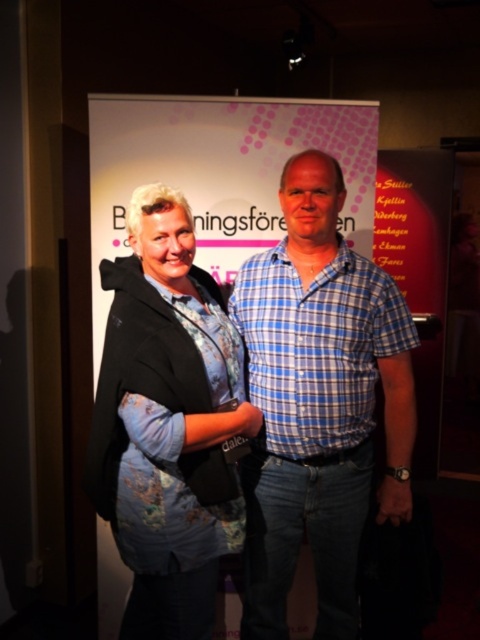
From the picture: Does blue plaid shirt at center have a lesser width compared to floral fabric blouse at center?

In fact, blue plaid shirt at center might be wider than floral fabric blouse at center.

Can you confirm if blue plaid shirt at center is positioned above floral fabric blouse at center?

Actually, blue plaid shirt at center is below floral fabric blouse at center.

This screenshot has width=480, height=640. I want to click on blue plaid shirt at center, so click(x=319, y=403).

What are the coordinates of `blue plaid shirt at center` in the screenshot? It's located at point(319,403).